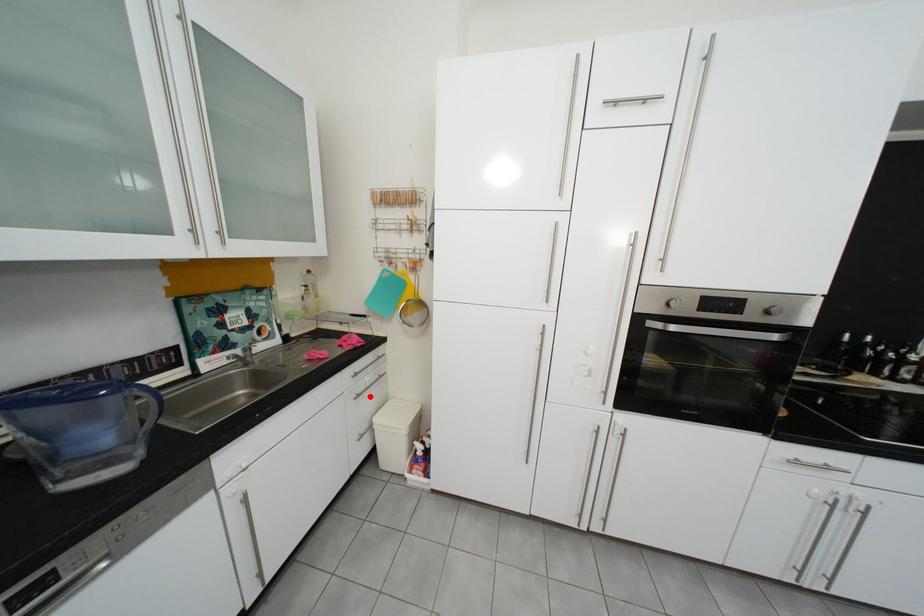
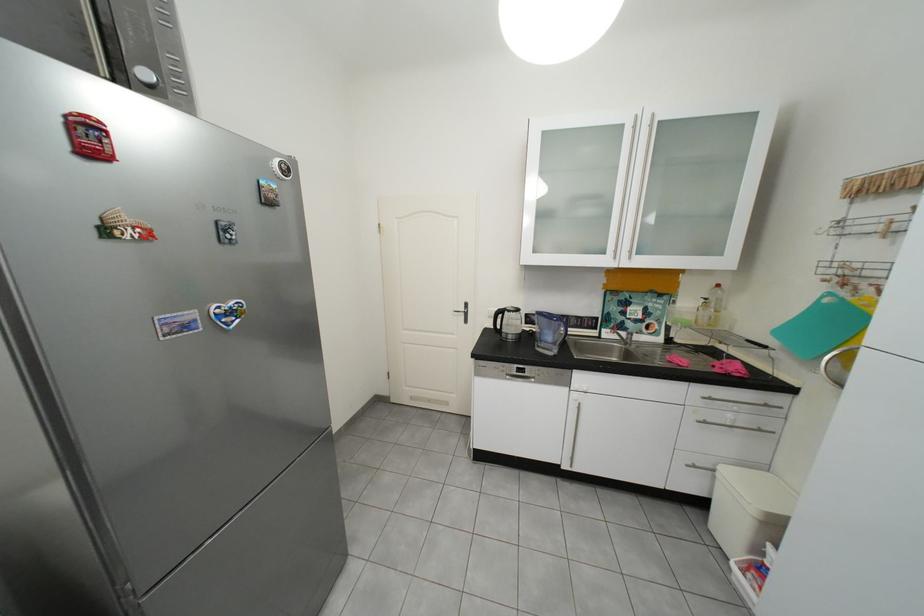
Locate, in the second image, the point that corresponds to the highlighted location in the first image.

(718, 424)